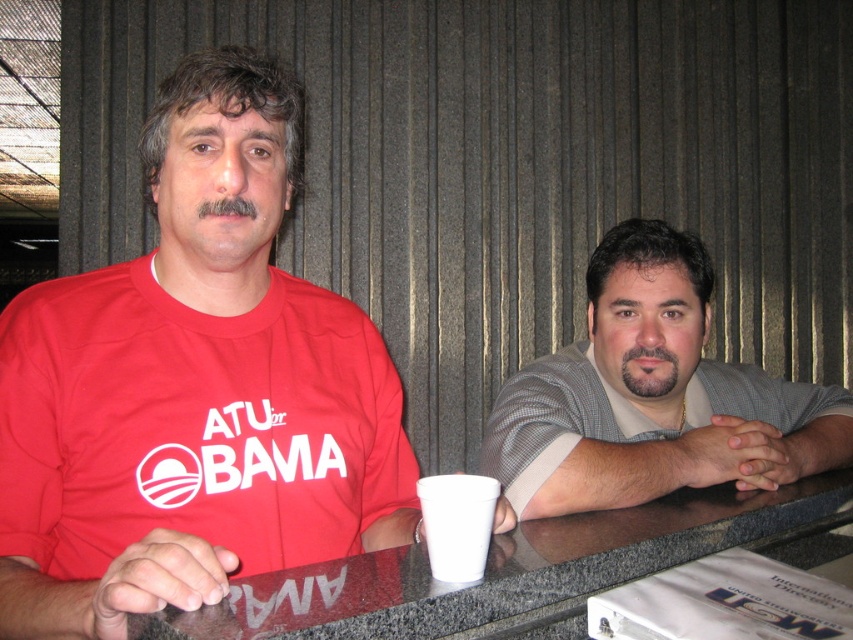
Question: Which of these objects is positioned closest to the granite table at center?

Choices:
 (A) matte red t-shirt at left
 (B) gray textured shirt at right
 (C) white styrofoam cup at lower center

Answer: (C)

Question: Considering the relative positions of matte red t-shirt at left and white styrofoam cup at lower center in the image provided, where is matte red t-shirt at left located with respect to white styrofoam cup at lower center?

Choices:
 (A) above
 (B) below

Answer: (A)

Question: Does matte red t-shirt at left appear over white styrofoam cup at lower center?

Choices:
 (A) yes
 (B) no

Answer: (A)

Question: Which of the following is the closest to the observer?

Choices:
 (A) white styrofoam cup at lower center
 (B) gray textured shirt at right
 (C) matte red t-shirt at left

Answer: (C)

Question: Is gray textured shirt at right wider than white styrofoam cup at lower center?

Choices:
 (A) yes
 (B) no

Answer: (A)

Question: Which object is positioned closest to the gray textured shirt at right?

Choices:
 (A) granite table at center
 (B) matte red t-shirt at left
 (C) white styrofoam cup at lower center

Answer: (A)